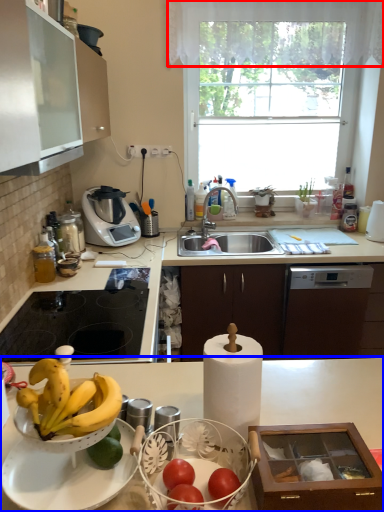
Question: Which point is further to the camera, curtain (highlighted by a red box) or countertop (highlighted by a blue box)?

Choices:
 (A) curtain
 (B) countertop

Answer: (A)